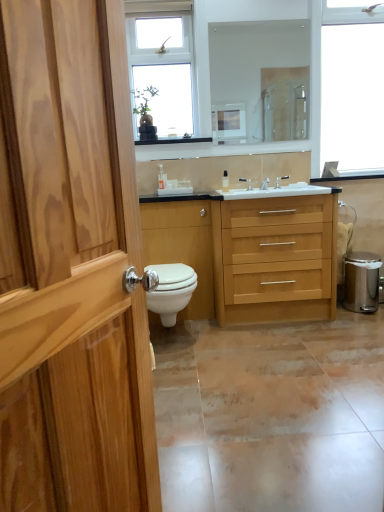
Question: Would you say matte ceramic tile at lower center is inside or outside clear glass mirror at upper center?

Choices:
 (A) outside
 (B) inside

Answer: (A)

Question: Considering the positions of point (170, 478) and point (253, 105), is point (170, 478) closer or farther from the camera than point (253, 105)?

Choices:
 (A) closer
 (B) farther

Answer: (A)

Question: Which object is positioned farthest from the wooden drawer at center?

Choices:
 (A) silver metallic faucet at center, marked as the 2th tap in a left-to-right arrangement
 (B) clear glass window at upper center, placed as the second window when sorted from right to left
 (C) silver metallic trash can at lower right
 (D) transparent plastic bottle at center, which is the first toiletry in right-to-left order
 (E) clear glass mirror at upper center

Answer: (E)

Question: Estimate the real-world distances between objects in this image. Which object is closer to the clear plastic bottle at center, the 1th toiletry in the left-to-right sequence?

Choices:
 (A) white glossy toilet at center
 (B) silver metallic faucet at center, acting as the third tap starting from the left
 (C) silver metallic trash can at lower right
 (D) white glossy toilet at center
 (E) transparent glass window at upper right, arranged as the first window when viewed from the right

Answer: (A)